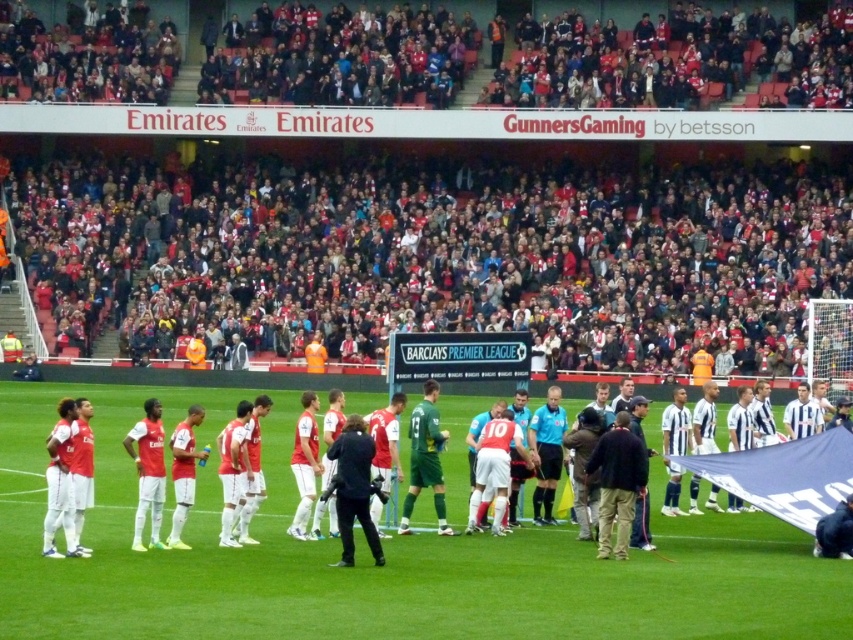
Question: Is red fabric crowd at upper center thinner than dark blue jersey at center?

Choices:
 (A) yes
 (B) no

Answer: (B)

Question: Among these points, which one is farthest from the camera?

Choices:
 (A) (450, 529)
 (B) (172, 403)
 (C) (605, 508)

Answer: (B)

Question: Which of these objects is positioned closest to the green jersey at center?

Choices:
 (A) matte red jersey at left
 (B) dark blue jacket at center
 (C) dark blue jersey at center

Answer: (B)

Question: Can you confirm if dark blue jersey at center is smaller than green jersey at center?

Choices:
 (A) yes
 (B) no

Answer: (B)

Question: Which point is closer to the camera?

Choices:
 (A) matte red jersey at left
 (B) dark blue jacket at center
 (C) dark blue jersey at center

Answer: (B)

Question: Can you confirm if matte red jersey at left is thinner than dark blue jersey at center?

Choices:
 (A) no
 (B) yes

Answer: (A)